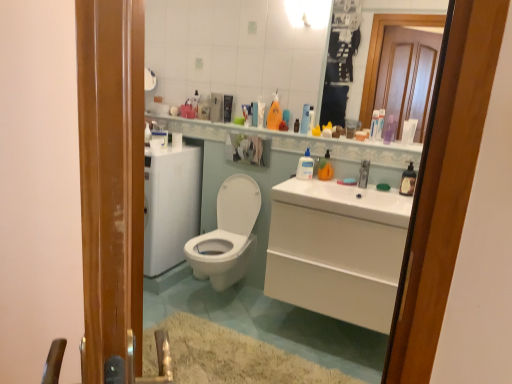
Where is `free point below white glossy sink at center, arranged as the first sink when viewed from the left (from a real-world perspective)`? free point below white glossy sink at center, arranged as the first sink when viewed from the left (from a real-world perspective) is located at coordinates (325, 337).